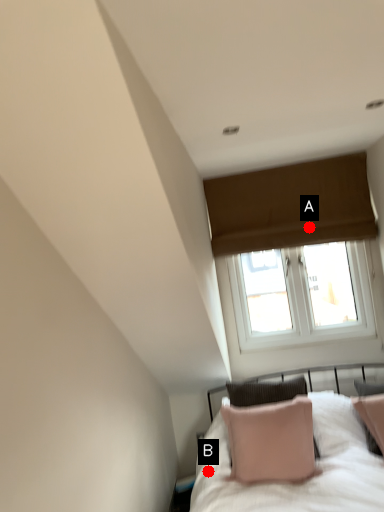
Question: Two points are circled on the image, labeled by A and B beside each circle. Among these points, which one is nearest to the camera?

Choices:
 (A) A is closer
 (B) B is closer

Answer: (B)